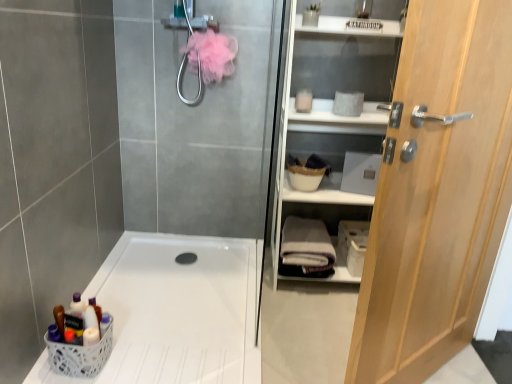
Locate an element on the screen. vacant area located to the right-hand side of white plastic basket at lower left is located at coordinates (141, 354).